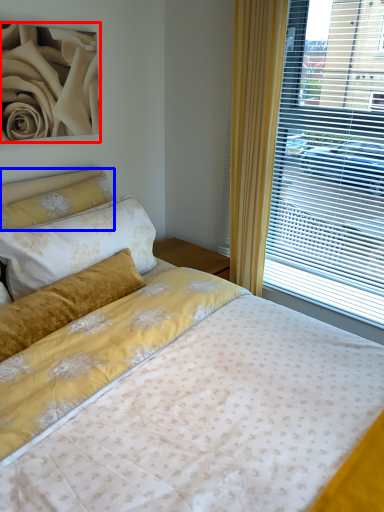
Question: Which of the following is the closest to the observer, rose (highlighted by a red box) or pillow (highlighted by a blue box)?

Choices:
 (A) rose
 (B) pillow

Answer: (A)